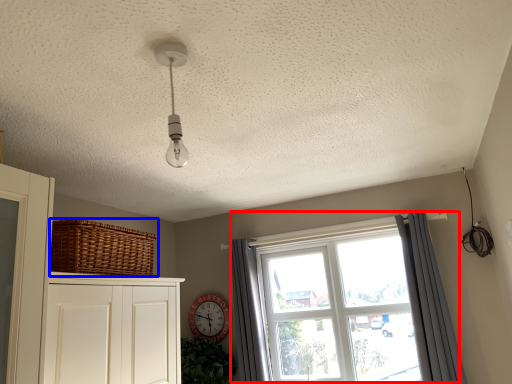
Question: Which object is further to the camera taking this photo, window (highlighted by a red box) or basket (highlighted by a blue box)?

Choices:
 (A) window
 (B) basket

Answer: (A)